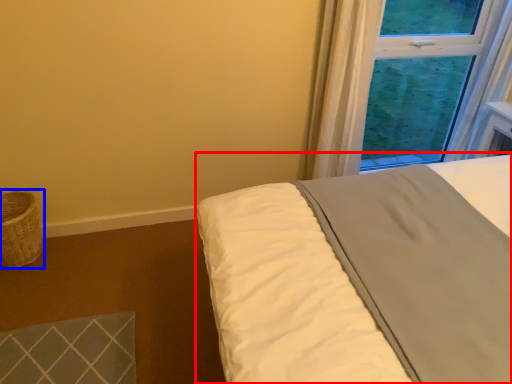
Question: Among these objects, which one is farthest to the camera, bed (highlighted by a red box) or basket (highlighted by a blue box)?

Choices:
 (A) bed
 (B) basket

Answer: (B)